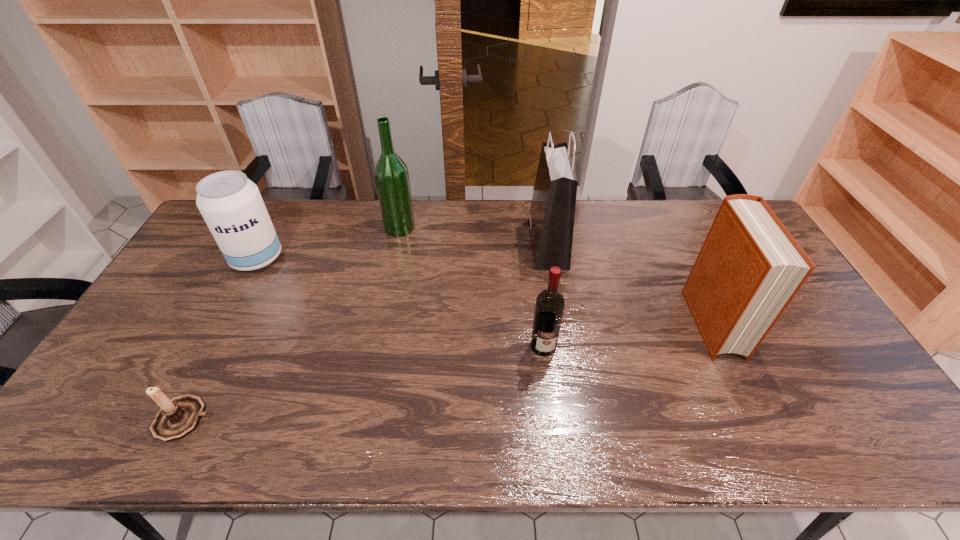
In the image, there is a desktop. At what (x,y) coordinates should I click in order to perform the action: click on free region at the far edge. Please return your answer as a coordinate pair (x, y). Looking at the image, I should click on pos(434,217).

Locate an element on the screen. Image resolution: width=960 pixels, height=540 pixels. vacant space at the near edge of the desktop is located at coordinates (251, 434).

The image size is (960, 540). I want to click on free space between the hardback book and the shopping bag, so click(x=630, y=283).

Locate an element on the screen. The height and width of the screenshot is (540, 960). vacant area that lies between the rightmost object and the rightmost alcohol is located at coordinates (628, 334).

What are the coordinates of `vacant space in between the rightmost object and the second nearest alcohol` in the screenshot? It's located at (484, 291).

At what (x,y) coordinates should I click in order to perform the action: click on vacant area that lies between the candle holder and the third object from left to right. Please return your answer as a coordinate pair (x, y). The width and height of the screenshot is (960, 540). Looking at the image, I should click on (292, 323).

Locate an element on the screen. The image size is (960, 540). blank region between the shopping bag and the hardback book is located at coordinates (630, 283).

In order to click on empty space between the rightmost alcohol and the candle holder in this screenshot , I will do `click(364, 383)`.

The height and width of the screenshot is (540, 960). Find the location of `free space between the shopping bag and the leftmost alcohol`. free space between the shopping bag and the leftmost alcohol is located at coordinates (402, 251).

Point out which object is positioned as the nearest to the leftmost alcohol. Please provide its 2D coordinates. Your answer should be formatted as a tuple, i.e. [(x, y)], where the tuple contains the x and y coordinates of a point satisfying the conditions above.

[(391, 175)]